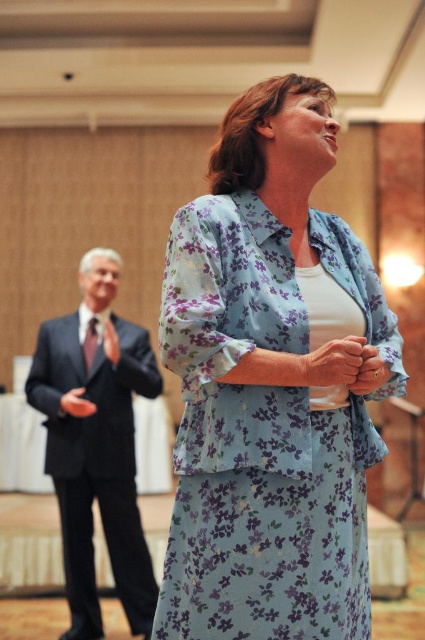
Is point (246, 195) closer to camera compared to point (125, 433)?

Yes, point (246, 195) is closer to viewer.

Which of these two, floral-patterned fabric dress at center or black suit at left, stands shorter?

floral-patterned fabric dress at center

What do you see at coordinates (265, 433) in the screenshot? This screenshot has height=640, width=425. I see `floral-patterned fabric dress at center` at bounding box center [265, 433].

Where is `floral-patterned fabric dress at center`? This screenshot has width=425, height=640. floral-patterned fabric dress at center is located at coordinates (265, 433).